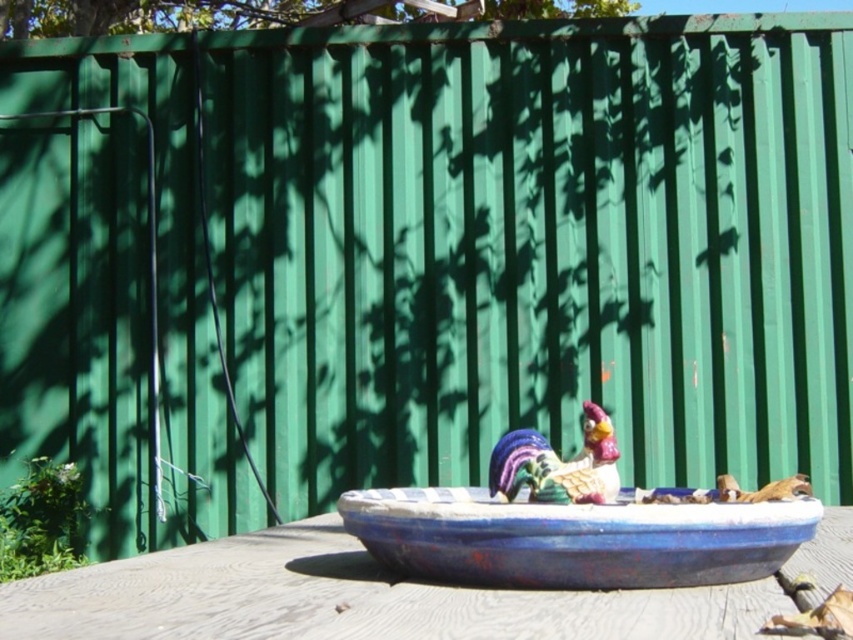
Describe the element at coordinates (575, 538) in the screenshot. The width and height of the screenshot is (853, 640). I see `blue painted ceramic bowl at center` at that location.

Can you confirm if blue painted ceramic bowl at center is taller than multicolored glazed ceramic rooster at center?

No, blue painted ceramic bowl at center is not taller than multicolored glazed ceramic rooster at center.

Locate an element on the screen. The height and width of the screenshot is (640, 853). blue painted ceramic bowl at center is located at coordinates (575, 538).

Does point (474, 634) come behind point (584, 493)?

No, it is in front of (584, 493).

Locate an element on the screen. The height and width of the screenshot is (640, 853). wooden table at center is located at coordinates (383, 596).

Identify the location of wooden table at center. This screenshot has width=853, height=640. (383, 596).

Which of these two, wooden table at center or blue painted ceramic bowl at center, stands shorter?

With less height is blue painted ceramic bowl at center.

Identify the location of wooden table at center. (383, 596).

This screenshot has height=640, width=853. Describe the element at coordinates (383, 596) in the screenshot. I see `wooden table at center` at that location.

This screenshot has width=853, height=640. I want to click on wooden table at center, so click(383, 596).